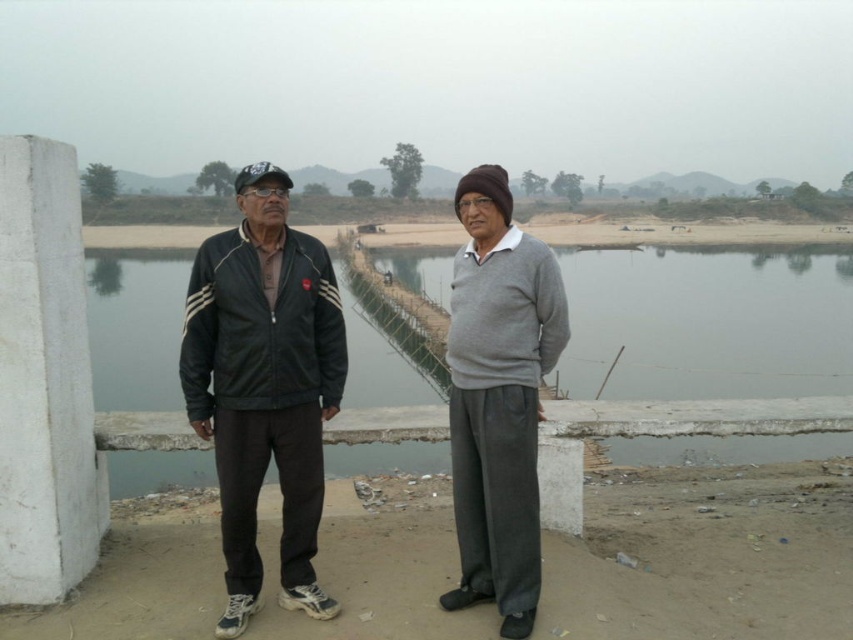
You are planning to cross the gray concrete river at center with a 1.5 meter wide boat. Considering the black leather jacket at left is 1 meter wide, can the boat fit through the river? Explain your reasoning.

The gray concrete river at center has a width larger than the black leather jacket at left, which is 1 meter wide. Since the boat is 1.5 meters wide, the river must be wider than 1.5 meters to accommodate the boat. However, the exact width of the river isn not provided, so we cannot confirm if the boat will fit. More information is needed.

You are a photographer trying to capture both the black leather jacket at center and the gray concrete river at center in a single frame. Based on their positions, which object should you focus on first to ensure both are in the shot?

The black leather jacket at center is positioned on the left side of the gray concrete river at center, so you should focus on the gray concrete river at center first to ensure both are in the shot.